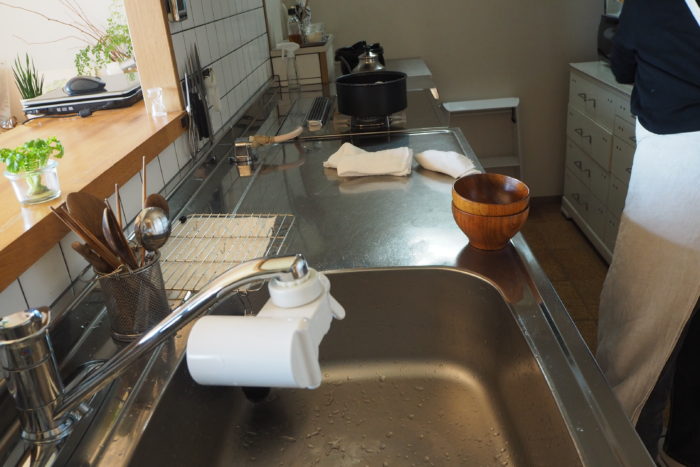
Identify the location of wooden bowls. Image resolution: width=700 pixels, height=467 pixels. (484, 201), (486, 214).